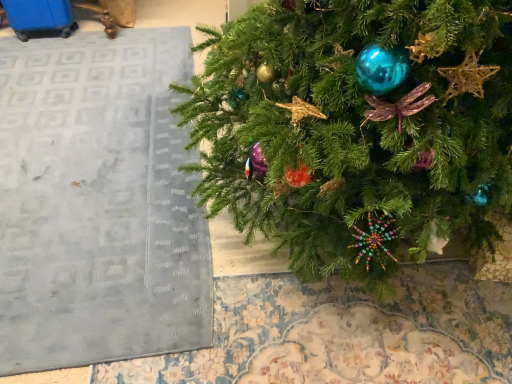
Describe the element at coordinates (98, 203) in the screenshot. I see `matte gray rug at lower left` at that location.

Locate an element on the screen. matte gray rug at lower left is located at coordinates (98, 203).

Identify the location of green matte christmas tree at center. pyautogui.click(x=356, y=126).

In order to face green matte christmas tree at center, should I rotate leftwards or rightwards?

It's best to rotate right around 11.918 degrees.

The image size is (512, 384). What do you see at coordinates (356, 126) in the screenshot?
I see `green matte christmas tree at center` at bounding box center [356, 126].

You are a GUI agent. You are given a task and a screenshot of the screen. Output one action in this format:
    pyautogui.click(x=<x>, y=<y>)
    Task: Click on the matte gray rug at lower left
    Image resolution: width=512 pixels, height=384 pixels.
    Given the screenshot: What is the action you would take?
    pyautogui.click(x=98, y=203)

Does matte gray rug at lower left appear on the left side of green matte christmas tree at center?

Indeed, matte gray rug at lower left is positioned on the left side of green matte christmas tree at center.

Is matte gray rug at lower left in front of green matte christmas tree at center?

No, matte gray rug at lower left is further to the viewer.

Does point (4, 185) appear closer or farther from the camera than point (325, 179)?

Point (4, 185) is positioned farther from the camera compared to point (325, 179).

From the image's perspective, does matte gray rug at lower left appear higher than green matte christmas tree at center?

No, from the image's perspective, matte gray rug at lower left is not above green matte christmas tree at center.

From a real-world perspective, who is located lower, matte gray rug at lower left or green matte christmas tree at center?

From a 3D spatial view, matte gray rug at lower left is below.

Is matte gray rug at lower left wider or thinner than green matte christmas tree at center?

In the image, matte gray rug at lower left appears to be wider than green matte christmas tree at center.

Who is shorter, matte gray rug at lower left or green matte christmas tree at center?

matte gray rug at lower left is shorter.

Who is bigger, matte gray rug at lower left or green matte christmas tree at center?

green matte christmas tree at center is bigger.

Is matte gray rug at lower left not within green matte christmas tree at center?

→ Indeed, matte gray rug at lower left is completely outside green matte christmas tree at center.

Is matte gray rug at lower left positioned far away from green matte christmas tree at center?

matte gray rug at lower left is near green matte christmas tree at center, not far away.

In the scene shown: Is matte gray rug at lower left oriented away from green matte christmas tree at center?

No, matte gray rug at lower left is not facing away from green matte christmas tree at center.

Image resolution: width=512 pixels, height=384 pixels. In the image, there is a green matte christmas tree at center. What are the coordinates of `bulletin board below it (from the image's perspective)` in the screenshot? It's located at (98, 203).

Would you say green matte christmas tree at center is to the left or to the right of matte gray rug at lower left in the picture?

From the image, it's evident that green matte christmas tree at center is to the right of matte gray rug at lower left.

Between green matte christmas tree at center and matte gray rug at lower left, which one is positioned in front?

Positioned in front is green matte christmas tree at center.

Which point is more forward, (244,22) or (30,99)?

Point (244,22)

From the image's perspective, which one is positioned higher, green matte christmas tree at center or matte gray rug at lower left?

green matte christmas tree at center is shown above in the image.

From a real-world perspective, which is physically below, green matte christmas tree at center or matte gray rug at lower left?

matte gray rug at lower left, from a real-world perspective.

Looking at this image, between green matte christmas tree at center and matte gray rug at lower left, which one has larger width?

Wider between the two is matte gray rug at lower left.

Is green matte christmas tree at center shorter than matte gray rug at lower left?

No, green matte christmas tree at center is not shorter than matte gray rug at lower left.

Does green matte christmas tree at center have a smaller size compared to matte gray rug at lower left?

No.

Choose the correct answer: Is green matte christmas tree at center inside matte gray rug at lower left or outside it?

green matte christmas tree at center is not enclosed by matte gray rug at lower left.

Does green matte christmas tree at center touch matte gray rug at lower left?

No, green matte christmas tree at center is not beside matte gray rug at lower left.

Is green matte christmas tree at center facing towards matte gray rug at lower left?

Yes, green matte christmas tree at center faces towards matte gray rug at lower left.

How different are the orientations of green matte christmas tree at center and matte gray rug at lower left in degrees?

There is a 92.6-degree angle between the facing directions of green matte christmas tree at center and matte gray rug at lower left.

Image resolution: width=512 pixels, height=384 pixels. What are the coordinates of `christmas tree in front of the matte gray rug at lower left` in the screenshot? It's located at (356, 126).

The height and width of the screenshot is (384, 512). I want to click on christmas tree located in front of the matte gray rug at lower left, so click(356, 126).

Image resolution: width=512 pixels, height=384 pixels. What are the coordinates of `christmas tree that is above the matte gray rug at lower left (from the image's perspective)` in the screenshot? It's located at (356, 126).